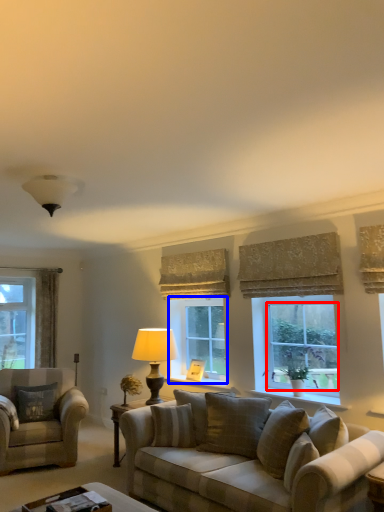
Question: Which point is further to the camera, window screen (highlighted by a red box) or window (highlighted by a blue box)?

Choices:
 (A) window screen
 (B) window

Answer: (B)